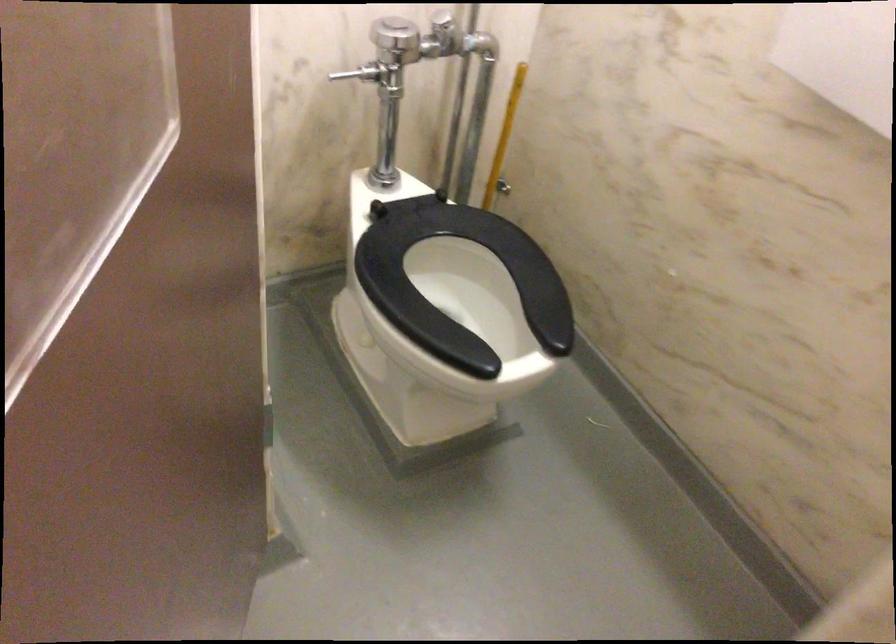
Where would you push the toilet flush handle? Please return your answer as a coordinate pair (x, y).

(362, 73)